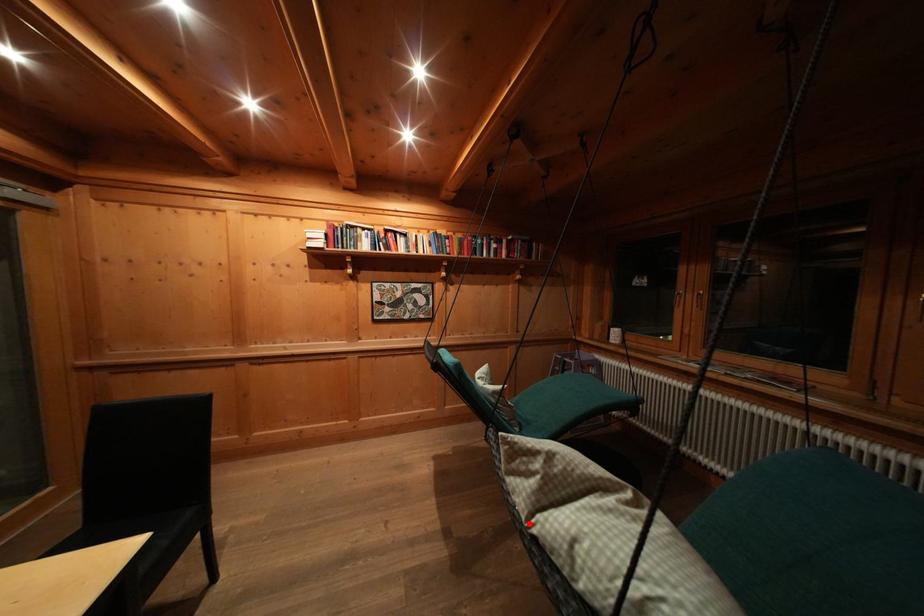
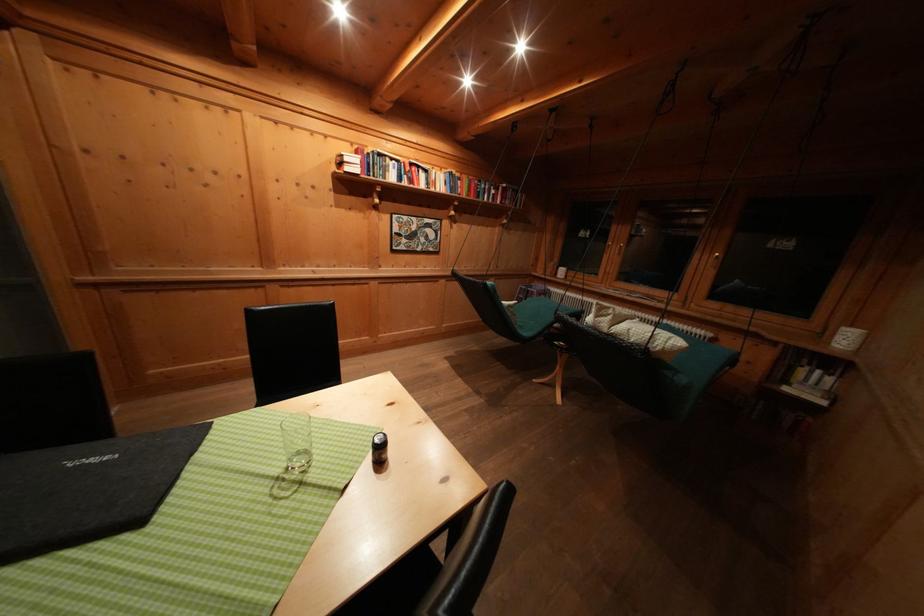
Question: I am providing you with two images of the same scene from different viewpoints. A red point is marked on the first image. Is the red point's position out of view in image 2?

Choices:
 (A) Yes
 (B) No

Answer: (B)